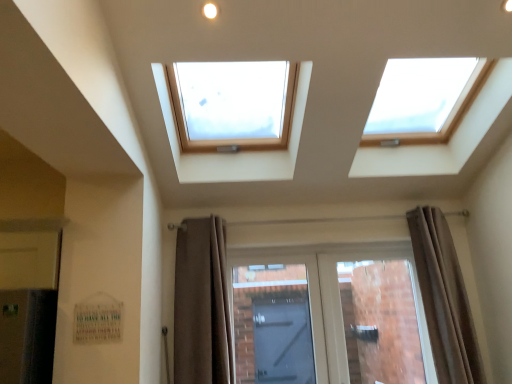
Locate an element on the screen. brown fabric curtain at lower center, acting as the 2th curtain starting from the right is located at coordinates (202, 304).

Find the location of a particular element. The width and height of the screenshot is (512, 384). matte glass door at center is located at coordinates (329, 315).

You are a GUI agent. You are given a task and a screenshot of the screen. Output one action in this format:
    pyautogui.click(x=<x>, y=<y>)
    Task: Click on the brown fabric curtain at lower center, acting as the 2th curtain starting from the right
    Image resolution: width=512 pixels, height=384 pixels.
    Given the screenshot: What is the action you would take?
    pyautogui.click(x=202, y=304)

Based on the photo, is brown fabric curtain at right, the first curtain when ordered from right to left, closer to camera compared to brown fabric curtain at lower center, the 1th curtain from the left?

No, brown fabric curtain at right, the first curtain when ordered from right to left, is further to the viewer.

I want to click on curtain on the left of brown fabric curtain at right, the first curtain when ordered from right to left, so click(x=202, y=304).

Is brown fabric curtain at right, the second curtain from the left, aimed at brown fabric curtain at lower center, acting as the 2th curtain starting from the right?

No, brown fabric curtain at right, the second curtain from the left, does not turn towards brown fabric curtain at lower center, acting as the 2th curtain starting from the right.

Choose the correct answer: Is brown fabric curtain at right, the first curtain when ordered from right to left, inside brown fabric curtain at lower center, the 1th curtain from the left, or outside it?

brown fabric curtain at right, the first curtain when ordered from right to left, is not inside brown fabric curtain at lower center, the 1th curtain from the left, it's outside.

From the image's perspective, is matte glass door at center located above or below brown fabric curtain at right, the first curtain when ordered from right to left?

matte glass door at center is situated lower than brown fabric curtain at right, the first curtain when ordered from right to left, in the image.

In the scene shown: Is matte glass door at center behind brown fabric curtain at right, the first curtain when ordered from right to left?

Yes.

Is matte glass door at center outside of brown fabric curtain at right, the first curtain when ordered from right to left?

Yes.

Would you say matte glass door at center is a long distance from brown fabric curtain at right, the second curtain from the left?

matte glass door at center is actually quite close to brown fabric curtain at right, the second curtain from the left.

From a real-world perspective, between brown fabric curtain at right, the first curtain when ordered from right to left, and matte glass door at center, who is vertically lower?

From a 3D spatial view, matte glass door at center is below.

Is brown fabric curtain at right, the first curtain when ordered from right to left, inside or outside of matte glass door at center?

The correct answer is: outside.

Who is taller, brown fabric curtain at right, the first curtain when ordered from right to left, or matte glass door at center?

Standing taller between the two is brown fabric curtain at right, the first curtain when ordered from right to left.

Locate an element on the screen. The image size is (512, 384). door below the brown fabric curtain at right, the second curtain from the left (from a real-world perspective) is located at coordinates (329, 315).

From a real-world perspective, is brown fabric curtain at lower center, acting as the 2th curtain starting from the right, on matte glass door at center?

Indeed, from a real-world perspective, brown fabric curtain at lower center, acting as the 2th curtain starting from the right, stands above matte glass door at center.

Is brown fabric curtain at lower center, acting as the 2th curtain starting from the right, bigger than matte glass door at center?

Incorrect, brown fabric curtain at lower center, acting as the 2th curtain starting from the right, is not larger than matte glass door at center.

From the image's perspective, which is above, brown fabric curtain at lower center, acting as the 2th curtain starting from the right, or matte glass door at center?

From the image's view, brown fabric curtain at lower center, acting as the 2th curtain starting from the right, is above.

The image size is (512, 384). I want to click on curtain positioned vertically above the brown fabric curtain at right, the second curtain from the left (from a real-world perspective), so click(x=202, y=304).

Can you confirm if brown fabric curtain at lower center, the 1th curtain from the left, is wider than brown fabric curtain at right, the second curtain from the left?

No.

From a real-world perspective, who is located higher, brown fabric curtain at lower center, the 1th curtain from the left, or brown fabric curtain at right, the first curtain when ordered from right to left?

From a 3D spatial view, brown fabric curtain at lower center, the 1th curtain from the left, is above.

In the image, there is a brown fabric curtain at lower center, acting as the 2th curtain starting from the right. Where is `door below it (from a real-world perspective)`? This screenshot has height=384, width=512. door below it (from a real-world perspective) is located at coordinates (329, 315).

Which of these two, matte glass door at center or brown fabric curtain at lower center, acting as the 2th curtain starting from the right, stands shorter?

matte glass door at center is shorter.

The width and height of the screenshot is (512, 384). I want to click on curtain below the brown fabric curtain at lower center, acting as the 2th curtain starting from the right (from a real-world perspective), so click(444, 299).

Where is `door to the left of brown fabric curtain at right, the second curtain from the left`? door to the left of brown fabric curtain at right, the second curtain from the left is located at coordinates (329, 315).

Estimate the real-world distances between objects in this image. Which object is further from brown fabric curtain at right, the second curtain from the left, brown fabric curtain at lower center, the 1th curtain from the left, or matte glass door at center?

The object further to brown fabric curtain at right, the second curtain from the left, is brown fabric curtain at lower center, the 1th curtain from the left.

Estimate the real-world distances between objects in this image. Which object is closer to brown fabric curtain at lower center, the 1th curtain from the left, brown fabric curtain at right, the first curtain when ordered from right to left, or matte glass door at center?

matte glass door at center is positioned closer to the anchor brown fabric curtain at lower center, the 1th curtain from the left.

From the image, which object appears to be farther from matte glass door at center, brown fabric curtain at lower center, the 1th curtain from the left, or brown fabric curtain at right, the first curtain when ordered from right to left?

brown fabric curtain at lower center, the 1th curtain from the left, is further to matte glass door at center.

When comparing their distances from brown fabric curtain at lower center, acting as the 2th curtain starting from the right, does matte glass door at center or brown fabric curtain at right, the second curtain from the left, seem further?

Among the two, brown fabric curtain at right, the second curtain from the left, is located further to brown fabric curtain at lower center, acting as the 2th curtain starting from the right.

From the image, which object appears to be nearer to brown fabric curtain at right, the first curtain when ordered from right to left, matte glass door at center or brown fabric curtain at lower center, acting as the 2th curtain starting from the right?

Based on the image, matte glass door at center appears to be nearer to brown fabric curtain at right, the first curtain when ordered from right to left.

Looking at the image, which one is located further to matte glass door at center, brown fabric curtain at right, the first curtain when ordered from right to left, or brown fabric curtain at lower center, acting as the 2th curtain starting from the right?

brown fabric curtain at lower center, acting as the 2th curtain starting from the right, lies further to matte glass door at center than the other object.

Identify the location of door between brown fabric curtain at lower center, acting as the 2th curtain starting from the right, and brown fabric curtain at right, the second curtain from the left, in the horizontal direction. (329, 315).